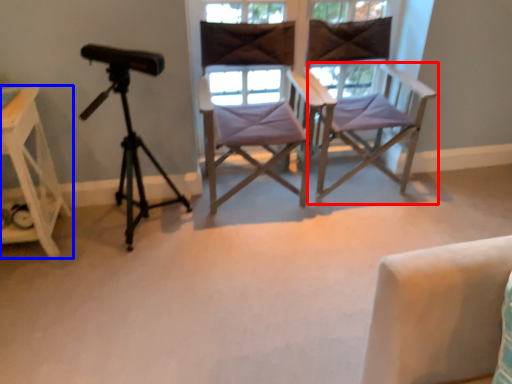
Question: Among these objects, which one is farthest to the camera, chair (highlighted by a red box) or furniture (highlighted by a blue box)?

Choices:
 (A) chair
 (B) furniture

Answer: (A)